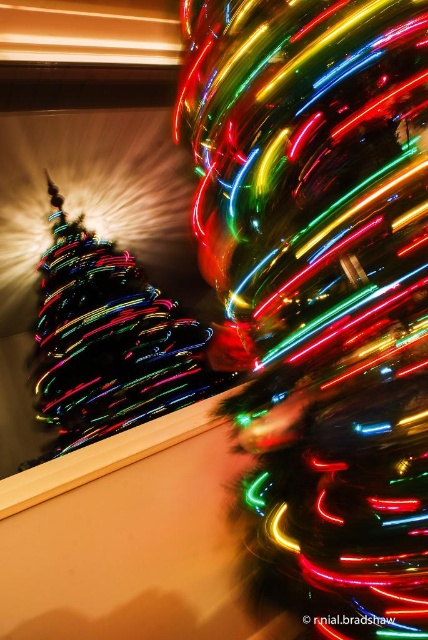
You are standing in front of the two Christmas trees and want to place a gift exactly halfway between the two points marked as point (x=354, y=72) and point (x=44, y=355). Will the gift be closer to the foreground tree or the background tree?

The gift placed halfway between point (x=354, y=72) and point (x=44, y=355) will be closer to the foreground tree because point (x=354, y=72) is closer to the camera than point (x=44, y=355). Since the foreground tree is closer to the viewer, the midpoint will still be nearer to it compared to the background tree.

You are a photographer planning to take a photo of the multicolored neon lights at center and the multicolored lights at left. You want to ensure that both sets of lights are in focus. If your camera has a depth of field of 2 meters, will both sets of lights be in focus?

The multicolored neon lights at center is 2.09 meters from the multicolored lights at left. Since the distance between them is slightly more than the camera depth of field of 2 meters, the multicolored neon lights at center and the multicolored lights at left may not both be in focus.